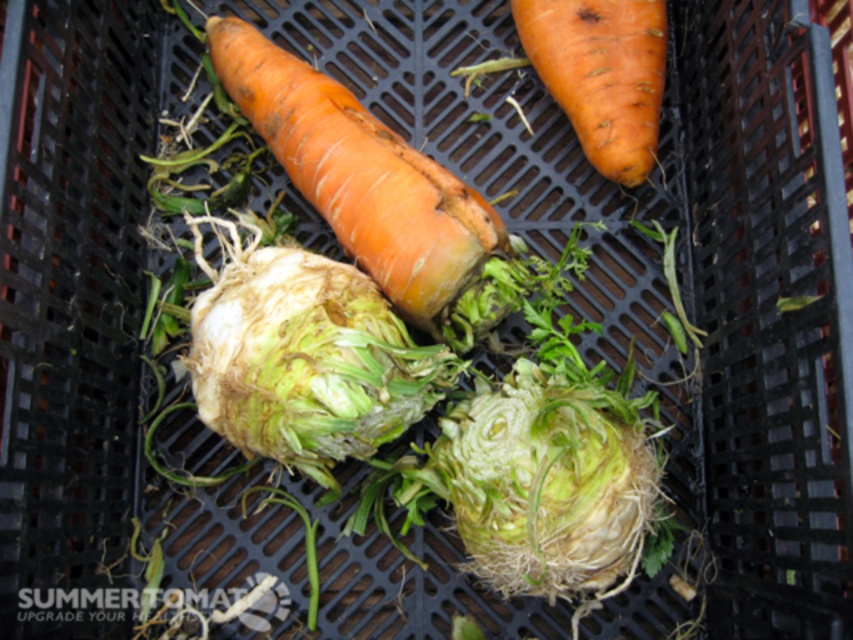
You are standing 40 inches away from the black plastic crate. Can you reach the point at coordinates point (289, 332) without moving closer?

The distance of point (289, 332) from viewer is 38.64 inches, so yes, you can reach it without moving closer since you are standing 40 inches away, which is slightly farther than the point.

You are a grocery store employee who needs to stack these vegetables into a pyramid display. The display requires that the base layer must be at least 8 inches wide to support the layers above. Can you place the green leafy celeriac at center and the green fibrous cabbage at center side by side on the base layer without exceeding the width requirement?

The distance between the green leafy celeriac at center and the green fibrous cabbage at center is 7.63 inches, which is less than the required 8 inches. Therefore, placing them side by side would not meet the width requirement for the base layer.

You are a grocery store employee arranging vegetables in a crate. You need to place the green leafy celeriac at center and the green fibrous cabbage at center in a way that follows the spatial arrangement shown in the image. Which vegetable should be placed higher up?

The green leafy celeriac at center should be placed higher up because it is located above the green fibrous cabbage at center in the image.